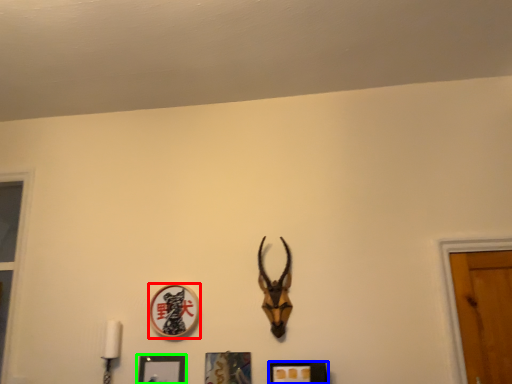
Question: Which is farther away from picture frame (highlighted by a red box)? picture frame (highlighted by a blue box) or picture frame (highlighted by a green box)?

Choices:
 (A) picture frame
 (B) picture frame

Answer: (A)